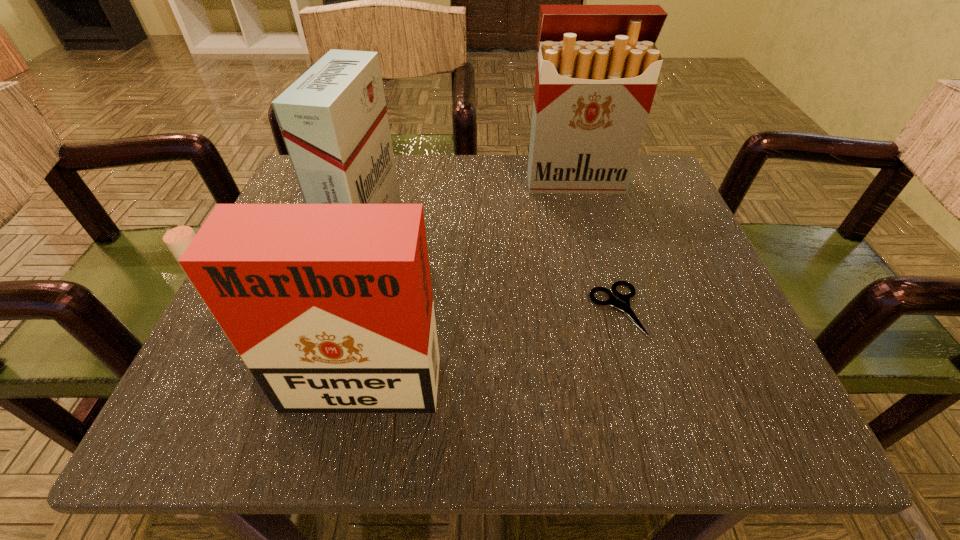
Locate an element on the screen. The height and width of the screenshot is (540, 960). cigarette case at the right edge is located at coordinates (597, 68).

The image size is (960, 540). I want to click on shears present at the right edge, so pyautogui.click(x=622, y=301).

Locate an element on the screen. The height and width of the screenshot is (540, 960). object that is at the far left corner is located at coordinates (333, 119).

This screenshot has height=540, width=960. I want to click on object positioned at the near left corner, so click(x=330, y=307).

This screenshot has width=960, height=540. In order to click on object that is at the far right corner in this screenshot , I will do `click(597, 68)`.

The image size is (960, 540). In order to click on free space at the far edge of the desktop in this screenshot , I will do `click(439, 181)`.

Image resolution: width=960 pixels, height=540 pixels. In order to click on vacant space at the near edge of the desktop in this screenshot , I will do `click(504, 416)`.

Identify the location of free space at the left edge of the desktop. click(230, 359).

Identify the location of vacant space at the right edge. 711,299.

The image size is (960, 540). Identify the location of vacant area at the far right corner. (662, 190).